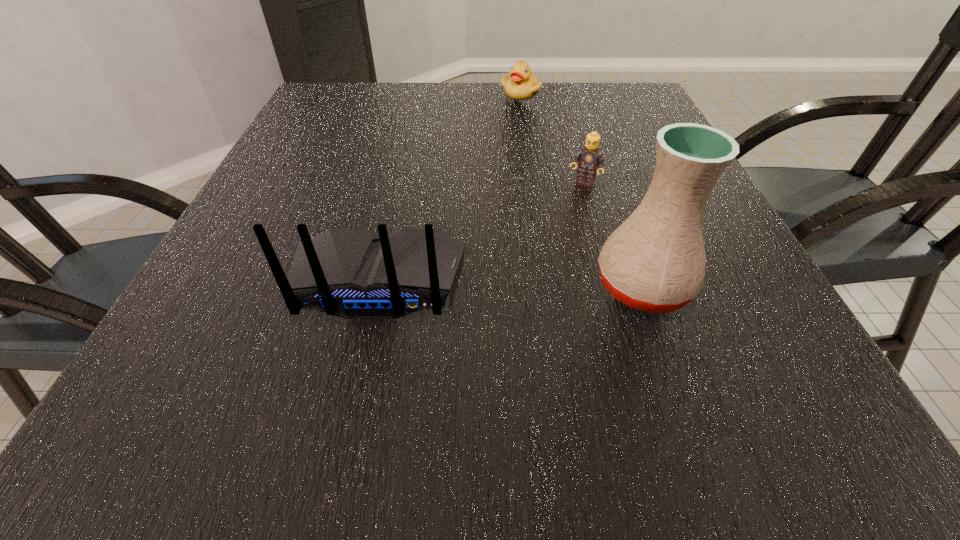
Find the location of `vacant spot on the desktop that is between the router and the tallest object and is positioned in front of the third tallest object`. vacant spot on the desktop that is between the router and the tallest object and is positioned in front of the third tallest object is located at coordinates (540, 284).

Find the location of a particular element. Image resolution: width=960 pixels, height=540 pixels. vacant space on the desktop that is between the third shortest object and the tallest object and is positioned on the front-facing side of the duckling is located at coordinates (505, 284).